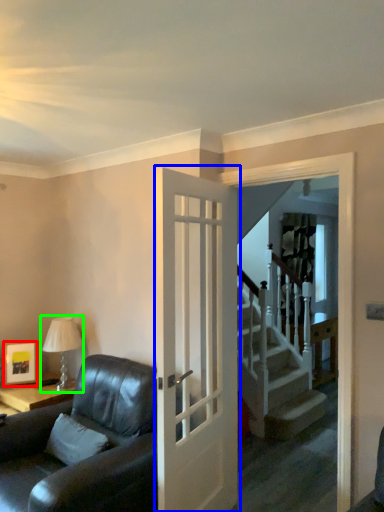
Question: Which object is positioned farthest from picture frame (highlighted by a red box)? Select from door (highlighted by a blue box) and table lamp (highlighted by a green box).

Choices:
 (A) door
 (B) table lamp

Answer: (A)